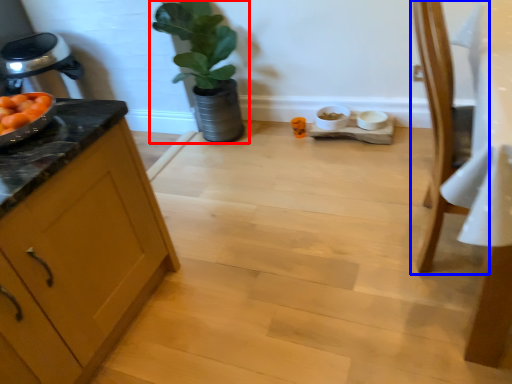
Question: Which object is closer to the camera taking this photo, houseplant (highlighted by a red box) or chair (highlighted by a blue box)?

Choices:
 (A) houseplant
 (B) chair

Answer: (B)